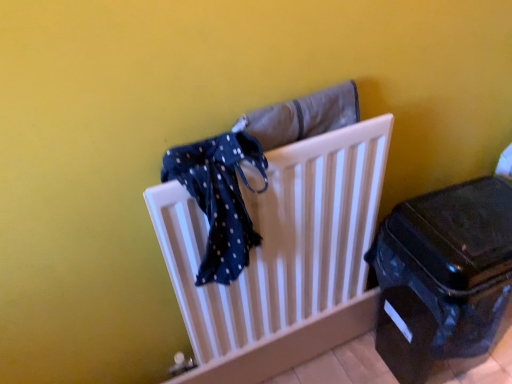
At what (x,y) coordinates should I click in order to perform the action: click on empty space that is ontop of white plastic radiator at center. Please return your answer as a coordinate pair (x, y). Looking at the image, I should click on (249, 154).